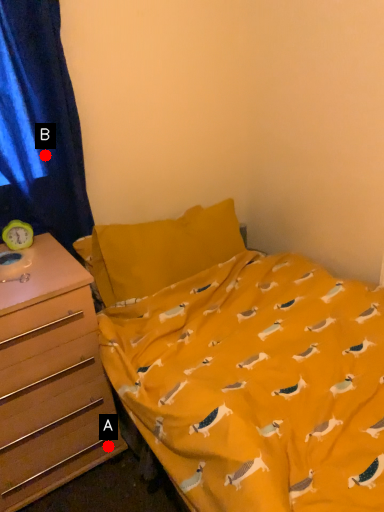
Question: Two points are circled on the image, labeled by A and B beside each circle. Which point appears farthest from the camera in this image?

Choices:
 (A) A is further
 (B) B is further

Answer: (A)